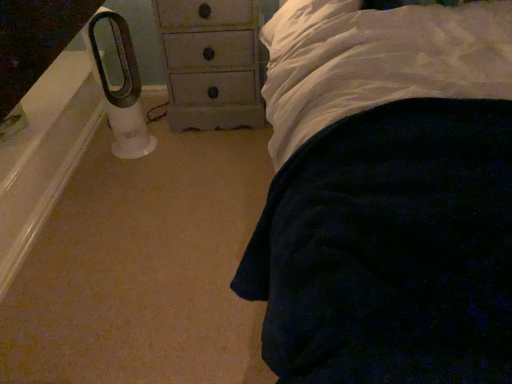
This screenshot has height=384, width=512. I want to click on free space in front of distressed wood chest of drawers at center, so click(208, 159).